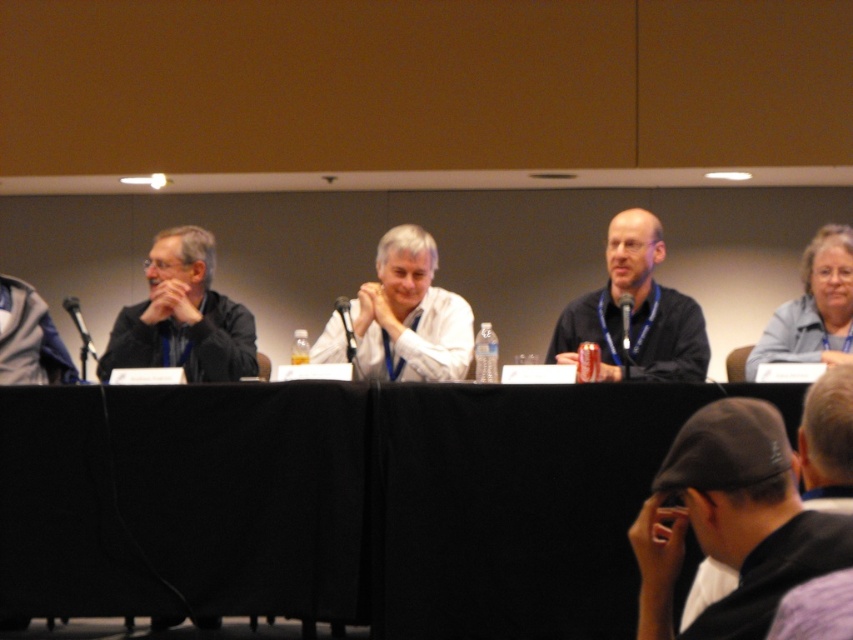
Is matte black shirt at center thinner than matte black shirt at left?

Yes.

Does matte black shirt at center appear on the left side of matte black shirt at left?

No, matte black shirt at center is not to the left of matte black shirt at left.

Does point (695, 358) come farther from viewer compared to point (125, 365)?

No, it is in front of (125, 365).

I want to click on matte black shirt at center, so click(x=635, y=312).

Which is above, black fabric table at center or gray fabric jacket at upper right?

gray fabric jacket at upper right

Is point (473, 522) in front of point (776, 362)?

Yes.

At what (x,y) coordinates should I click in order to perform the action: click on black fabric table at center. Please return your answer as a coordinate pair (x, y). This screenshot has width=853, height=640. Looking at the image, I should click on (339, 502).

Who is lower down, black fabric cap at lower right or white matte shirt at center?

black fabric cap at lower right

Is black fabric cap at lower right to the right of white matte shirt at center from the viewer's perspective?

Correct, you'll find black fabric cap at lower right to the right of white matte shirt at center.

Where is `black fabric cap at lower right`? Image resolution: width=853 pixels, height=640 pixels. black fabric cap at lower right is located at coordinates (730, 522).